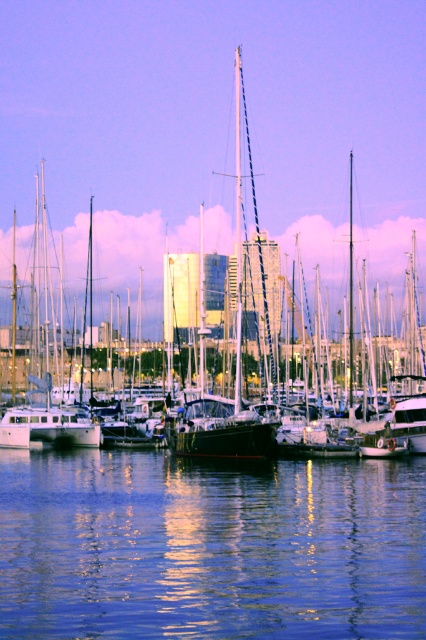
Question: Which point is farther from the camera taking this photo?

Choices:
 (A) (362, 284)
 (B) (5, 618)

Answer: (A)

Question: Among these points, which one is nearest to the camera?

Choices:
 (A) (379, 605)
 (B) (368, 310)

Answer: (A)

Question: Can you confirm if blue reflective water at center is thinner than shiny black sailboat at center?

Choices:
 (A) yes
 (B) no

Answer: (A)

Question: Is blue reflective water at center thinner than shiny black sailboat at center?

Choices:
 (A) no
 (B) yes

Answer: (B)

Question: Can you confirm if blue reflective water at center is positioned above shiny black sailboat at center?

Choices:
 (A) no
 (B) yes

Answer: (A)

Question: Which point is farther to the camera?

Choices:
 (A) shiny black sailboat at center
 (B) blue reflective water at center

Answer: (A)